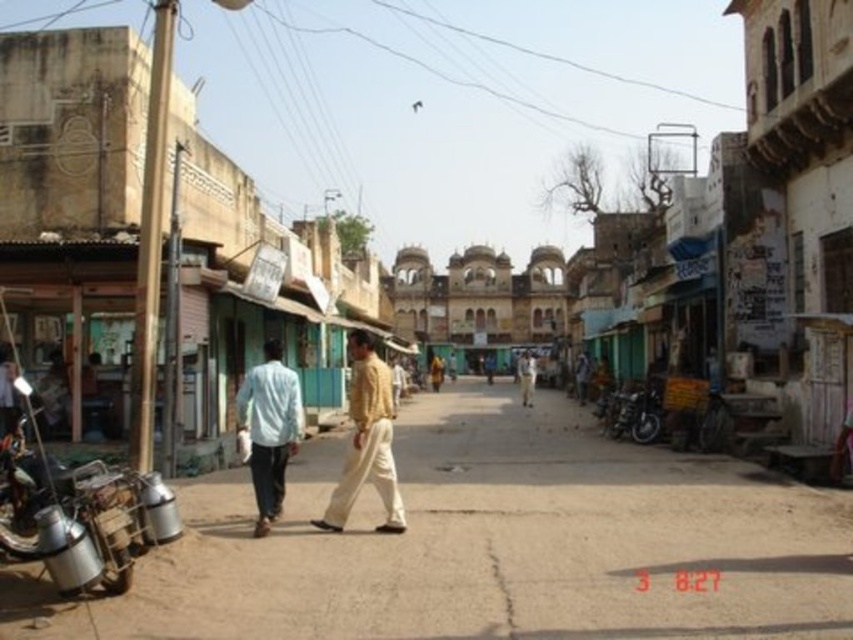
Question: Which point is closer to the camera taking this photo?

Choices:
 (A) click(122, 586)
 (B) click(274, 435)

Answer: (A)

Question: Is shiny metallic motorcycle at center-right closer to camera compared to light brown cotton shirt at center?

Choices:
 (A) yes
 (B) no

Answer: (A)

Question: From the image, what is the correct spatial relationship of light blue cotton shirt at center in relation to light brown cotton shirt at center?

Choices:
 (A) below
 (B) above

Answer: (B)

Question: Which point is closer to the camera taking this photo?

Choices:
 (A) (287, 420)
 (B) (73, 564)
 (C) (529, 388)

Answer: (B)

Question: Is smooth concrete alley at center bigger than metallic silver motorcycle at left?

Choices:
 (A) no
 (B) yes

Answer: (B)

Question: Among these objects, which one is nearest to the camera?

Choices:
 (A) light blue cotton shirt at center
 (B) light brown cotton shirt at center
 (C) metallic silver motorcycle at left
 (D) shiny metallic motorcycle at center-right

Answer: (C)